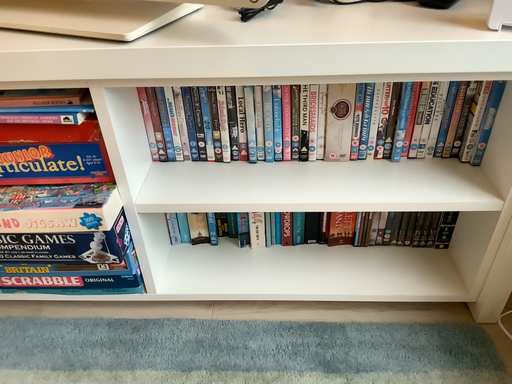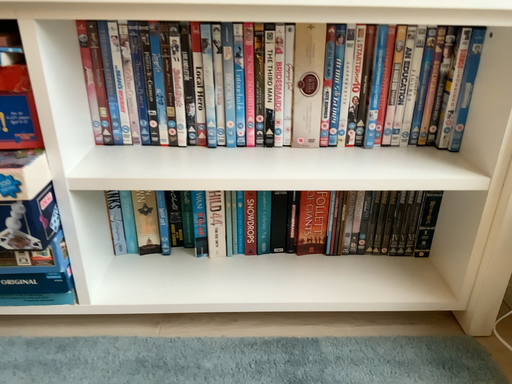
Question: Which way did the camera rotate in the video?

Choices:
 (A) rotated upward
 (B) rotated downward

Answer: (A)